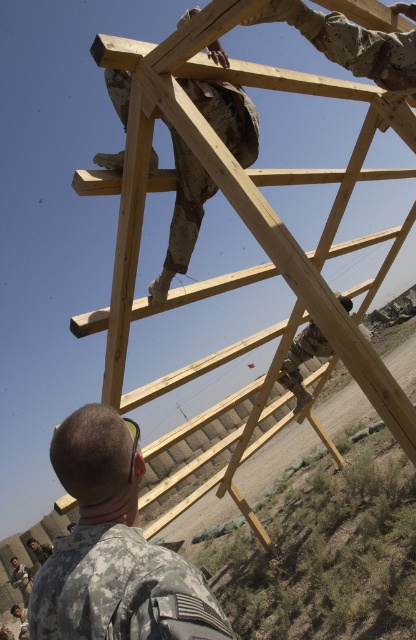
You are a soldier needing to reach the top of the light brown wooden ladder at upper center. Considering the size difference between the ladder and the camouflage fabric uniform at lower left, can you estimate if the ladder is tall enough to reach the top of the structure?

The light brown wooden ladder at upper center has a larger size compared to the camouflage fabric uniform at lower left. Since the ladder is larger, it is likely tall enough to reach the top of the structure.

You are a soldier trying to reach the top of the triangular frame structure. There is a light brown wooden ladder at upper center. Where should you position yourself to climb it?

The light brown wooden ladder at upper center is located at point (250,230), so you should position yourself at that coordinate to climb it.